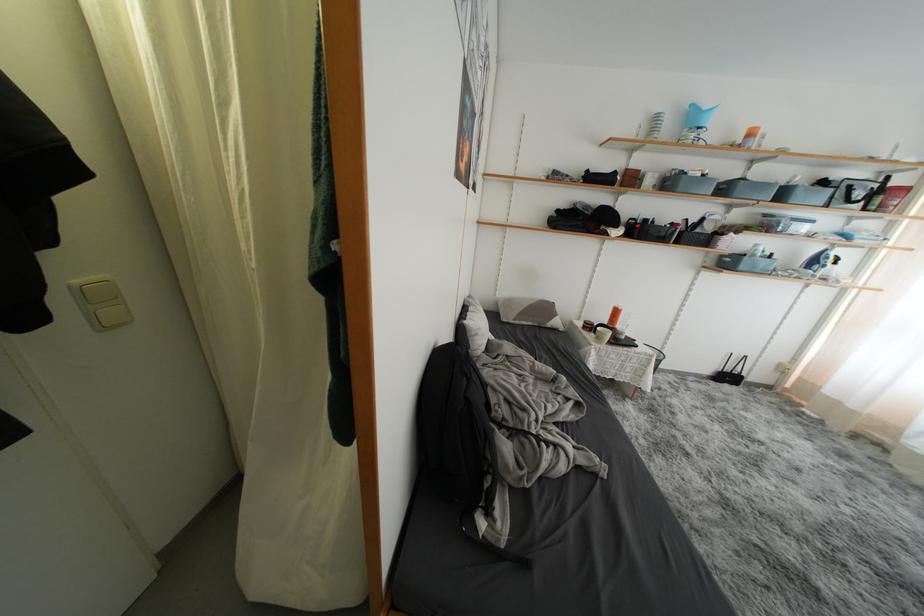
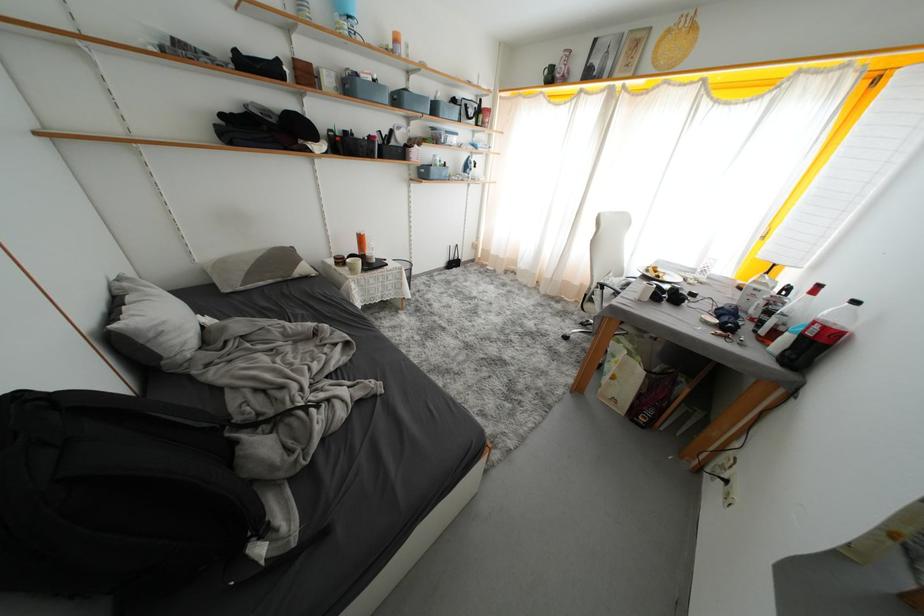
In the second image, find the point that corresponds to point 709,224 in the first image.

(397, 136)